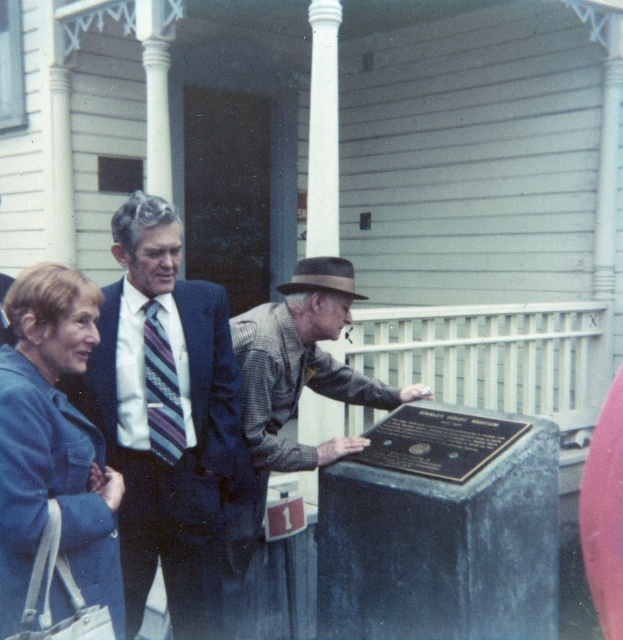
You are standing in front of the building and want to place a small flower pot between the two points, point [216,488] and point [232,634]. Which point should the flower pot be closer to in order to be nearer to the viewer?

The flower pot should be closer to point [216,488] because it is nearer to the viewer than point [232,634].

You are a photographer at the event and need to capture a photo of the striped tie at center and the plaid shirt at center. Based on their positions, which one appears higher in the image?

The striped tie at center appears higher in the image because it is taller than the plaid shirt at center.

You are a photographer positioned to the side of the scene. You need to capture a photo where both the striped tie at center and the bronze plaque at center are clearly visible. Given their relative sizes, which object might require you to adjust your framing to ensure it doesn

The striped tie at center is taller than the bronze plaque at center, so you may need to adjust your framing to accommodate its greater height to ensure both are clearly visible.